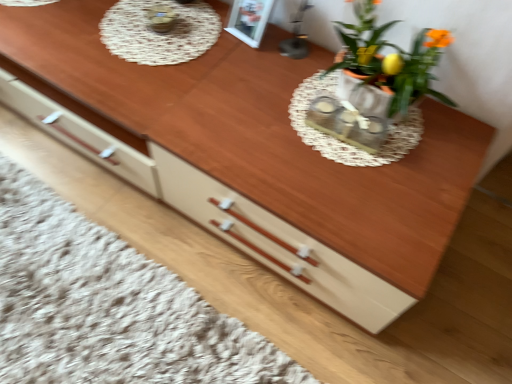
Locate an element on the screen. The image size is (512, 384). free space in front of white lace doily at upper center is located at coordinates (150, 99).